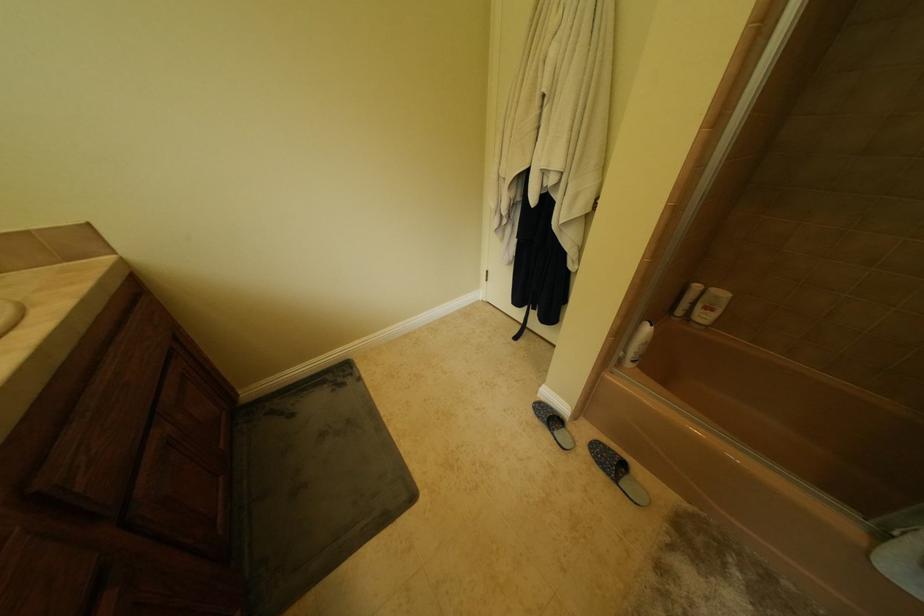
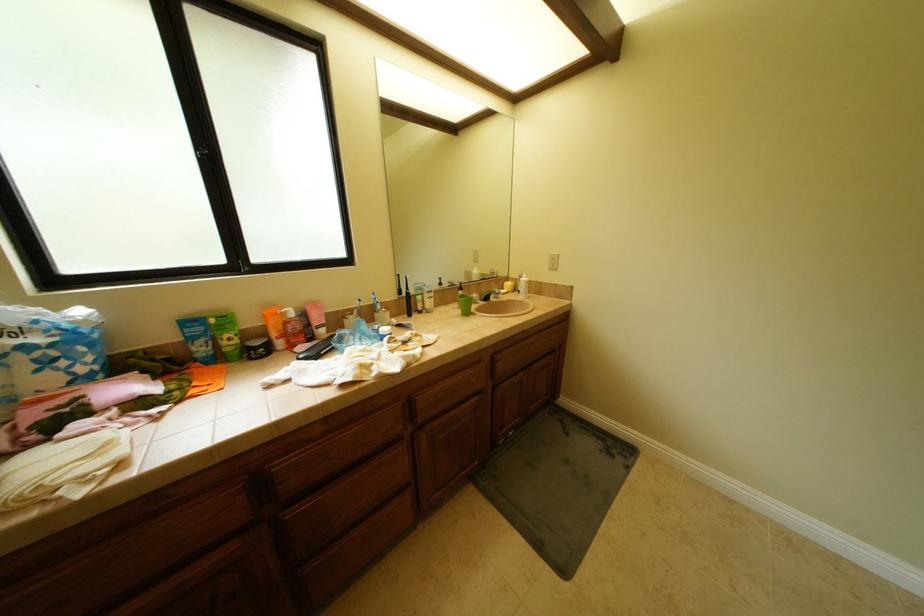
Question: The first image is from the beginning of the video and the second image is from the end. How did the camera likely rotate when shooting the video?

Choices:
 (A) Left
 (B) Right
 (C) Up
 (D) Down

Answer: (A)